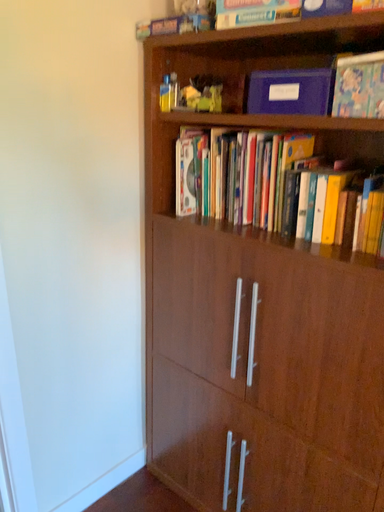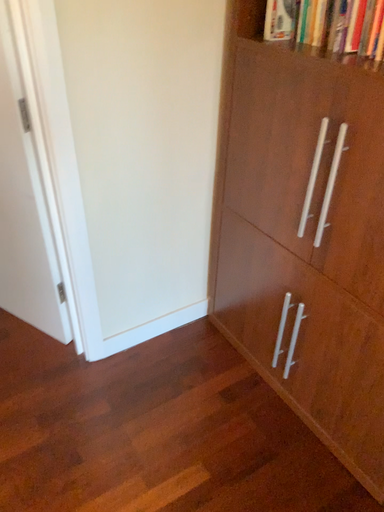
Question: Which way did the camera rotate in the video?

Choices:
 (A) rotated right
 (B) rotated left

Answer: (B)